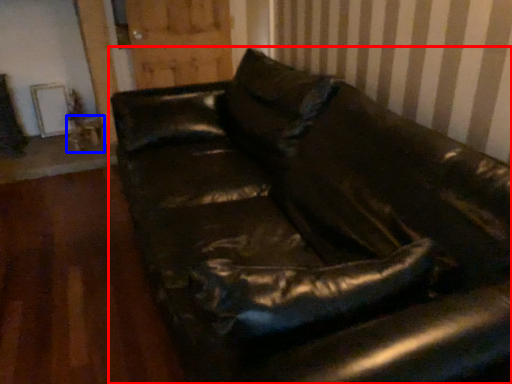
Question: Which of the following is the closest to the observer, studio couch (highlighted by a red box) or table (highlighted by a blue box)?

Choices:
 (A) studio couch
 (B) table

Answer: (A)